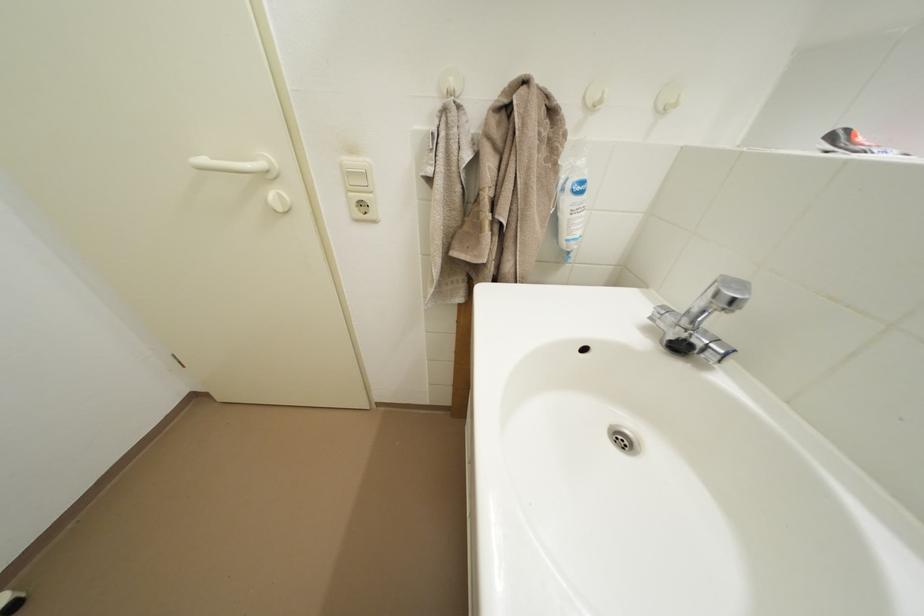
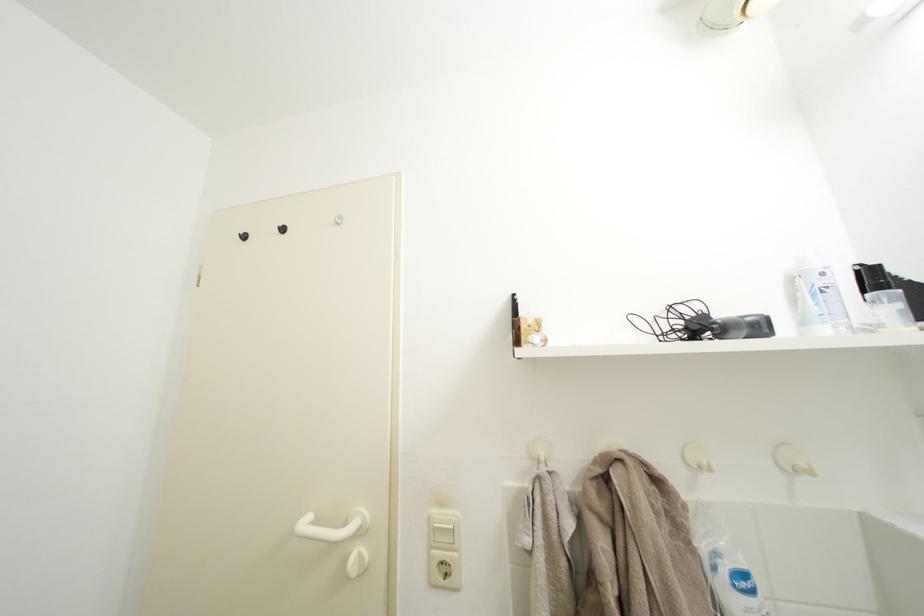
Locate, in the second image, the point that corresponds to the point at 358,205 in the first image.

(439, 562)